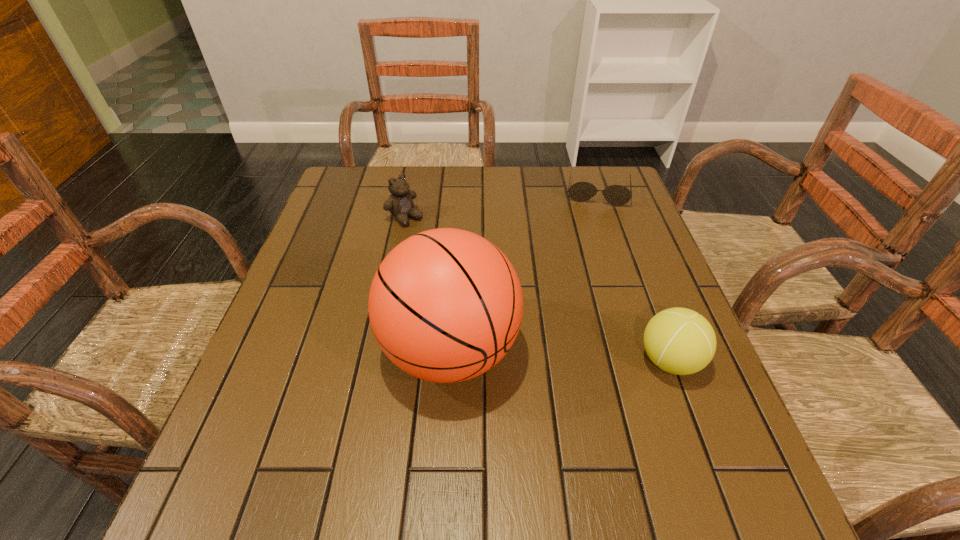
This screenshot has width=960, height=540. I want to click on free spot between the shortest object and the tallest object, so click(x=524, y=272).

Locate an element on the screen. This screenshot has height=540, width=960. vacant area between the basketball and the shortest object is located at coordinates (524, 272).

Identify the location of vacant space in between the teddy bear and the sunglasses. (501, 205).

Identify the location of the third closest object relative to the shortest object. (680, 341).

Locate an element on the screen. object that is the second closest to the shortest object is located at coordinates (400, 204).

Locate an element on the screen. Image resolution: width=960 pixels, height=540 pixels. free spot that satisfies the following two spatial constraints: 1. on the front side of the tallest object; 2. on the right side of the teddy bear is located at coordinates (377, 351).

Where is `free space that satisfies the following two spatial constraints: 1. on the back side of the sunglasses; 2. on the right side of the basketball`? The image size is (960, 540). free space that satisfies the following two spatial constraints: 1. on the back side of the sunglasses; 2. on the right side of the basketball is located at coordinates click(460, 192).

Identify the location of vacant region that satisfies the following two spatial constraints: 1. on the front side of the tennis ball; 2. on the left side of the shortest object. (656, 361).

You are a GUI agent. You are given a task and a screenshot of the screen. Output one action in this format:
    pyautogui.click(x=<x>, y=<y>)
    Task: Click on the free space that satisfies the following two spatial constraints: 1. on the front side of the basketball; 2. on the right side of the teddy bear
    
    Given the screenshot: What is the action you would take?
    pyautogui.click(x=377, y=351)